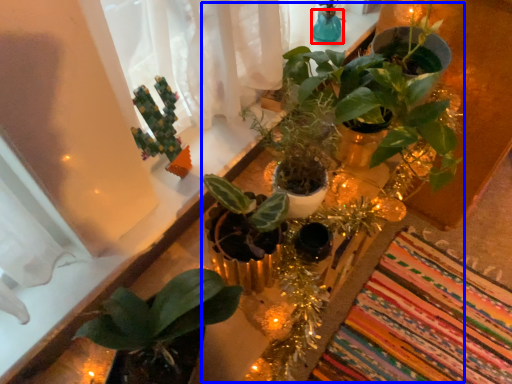
Question: Which object appears farthest to the camera in this image, glass vase (highlighted by a red box) or floral arrangement (highlighted by a blue box)?

Choices:
 (A) glass vase
 (B) floral arrangement

Answer: (A)